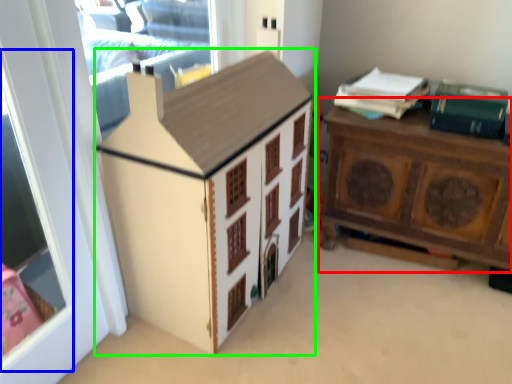
Question: Estimate the real-world distances between objects in this image. Which object is closer to nightstand (highlighted by a red box), window screen (highlighted by a blue box) or cabinetry (highlighted by a green box)?

Choices:
 (A) window screen
 (B) cabinetry

Answer: (B)